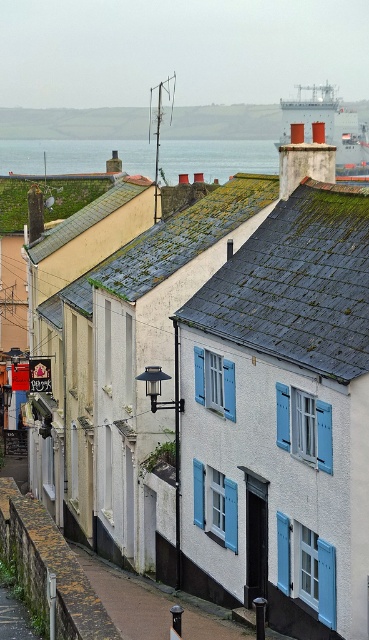
Question: Can you confirm if blue-green water at upper center is bigger than smooth concrete wall at upper center?

Choices:
 (A) no
 (B) yes

Answer: (B)

Question: Which point appears farthest from the camera in this image?

Choices:
 (A) (315, 100)
 (B) (222, 179)
 (C) (61, 108)

Answer: (C)

Question: Does blue-green water at upper center appear on the left side of metallic gray ship at upper center?

Choices:
 (A) yes
 (B) no

Answer: (A)

Question: Which point is farther from the camera taking this photo?

Choices:
 (A) (329, 124)
 (B) (197, 120)

Answer: (B)

Question: Which object is the closest to the metallic gray ship at upper center?

Choices:
 (A) smooth concrete wall at upper center
 (B) blue-green water at upper center

Answer: (B)

Question: Is the position of smooth concrete wall at upper center less distant than that of metallic gray ship at upper center?

Choices:
 (A) no
 (B) yes

Answer: (A)